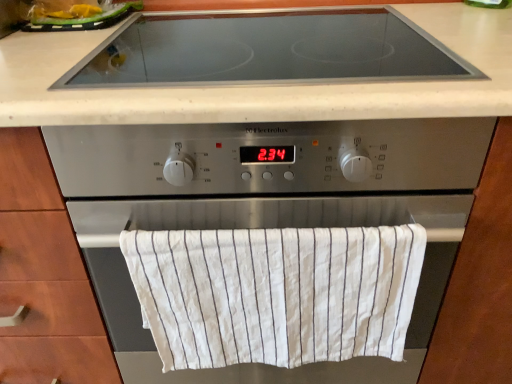
The width and height of the screenshot is (512, 384). In order to click on free space in front of yellow plastic bag at upper left in this screenshot , I will do `click(56, 36)`.